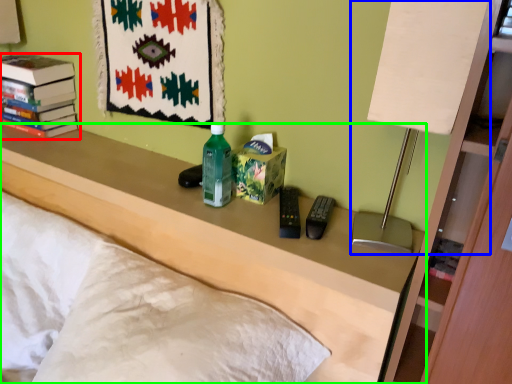
Question: Estimate the real-world distances between objects in this image. Which object is closer to book (highlighted by a red box), table lamp (highlighted by a blue box) or furniture (highlighted by a green box)?

Choices:
 (A) table lamp
 (B) furniture

Answer: (B)